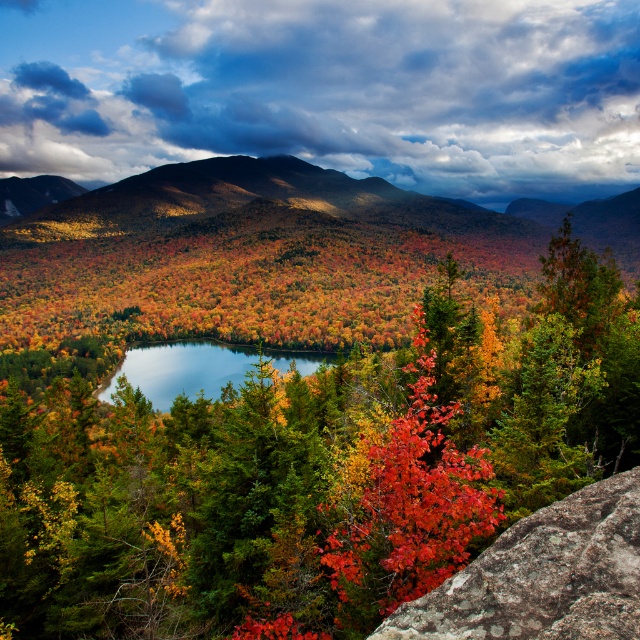
You are standing on the rocky outcrop in the foreground of the autumn landscape. You notice the autumn leaves at center and the blue glassy lake at center. Which object is positioned higher relative to the other?

The autumn leaves at center are located above the blue glassy lake at center, so they are positioned higher.

You are a photographer standing at the point marked by point (316, 468) in the image, which is autumn leaves at center. You want to take a photo of the rocky outcrop in the foreground and the serene lake in the middle ground. Which direction should you face to include both the rocky outcrop and the serene lake in your shot?

To include both the rocky outcrop and the serene lake in your photo, you should face towards the lower part of the image since the rocky outcrop is in the foreground and the lake is in the middle ground, both located below the autumn leaves at center marked by point (316, 468).

You are an artist planning to paint the autumn landscape. You want to ensure the autumn leaves at center and the blue glassy lake at center are positioned correctly. According to the scene, which object should appear closer to the viewer?

The autumn leaves at center should appear closer to the viewer because they are positioned in front of the blue glassy lake at center.